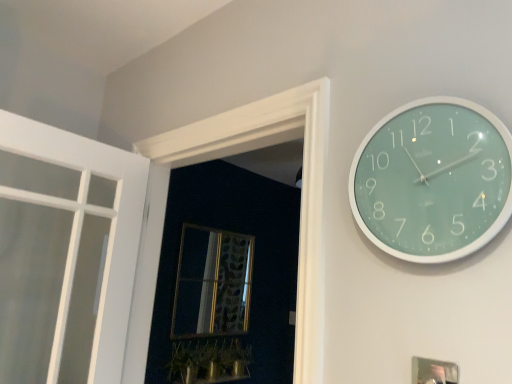
Question: From a real-world perspective, is gold-framed mirror at center physically located above or below metallic silver picture frame at lower right?

Choices:
 (A) below
 (B) above

Answer: (B)

Question: From their relative heights in the image, would you say gold-framed mirror at center is taller or shorter than metallic silver picture frame at lower right?

Choices:
 (A) short
 (B) tall

Answer: (B)

Question: Estimate the real-world distances between objects in this image. Which object is farther from the metallic silver picture frame at lower right?

Choices:
 (A) white wood frame at upper left
 (B) teal glossy clock at upper right
 (C) green glossy plant at lower center
 (D) gold-framed mirror at center

Answer: (D)

Question: Estimate the real-world distances between objects in this image. Which object is closer to the white wood frame at upper left?

Choices:
 (A) teal glossy clock at upper right
 (B) metallic silver picture frame at lower right
 (C) gold-framed mirror at center
 (D) green glossy plant at lower center

Answer: (A)